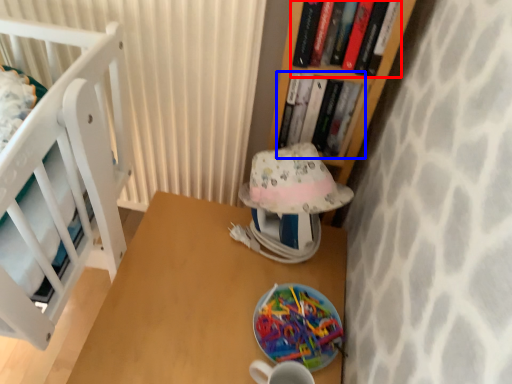
Question: Which object is further to the camera taking this photo, book (highlighted by a red box) or book (highlighted by a blue box)?

Choices:
 (A) book
 (B) book

Answer: (B)